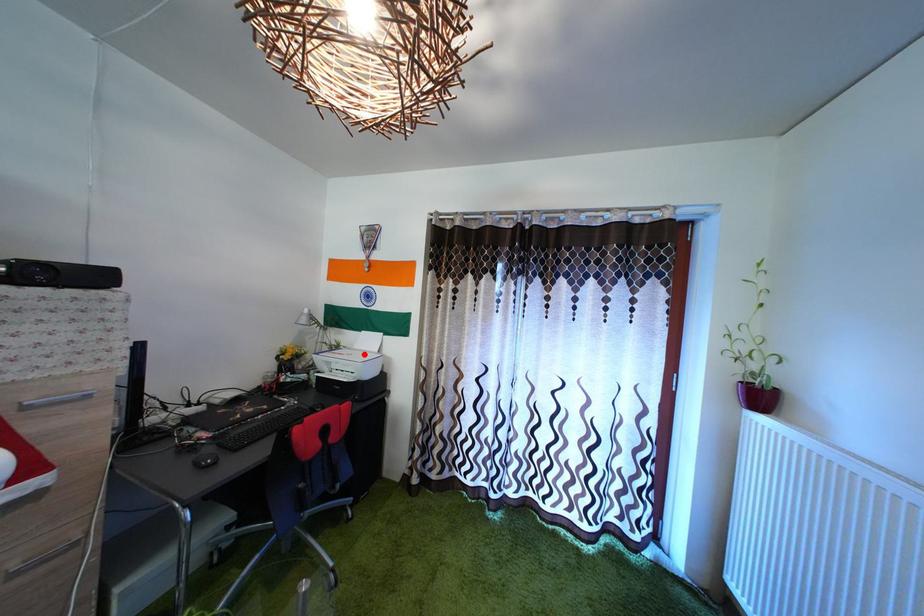
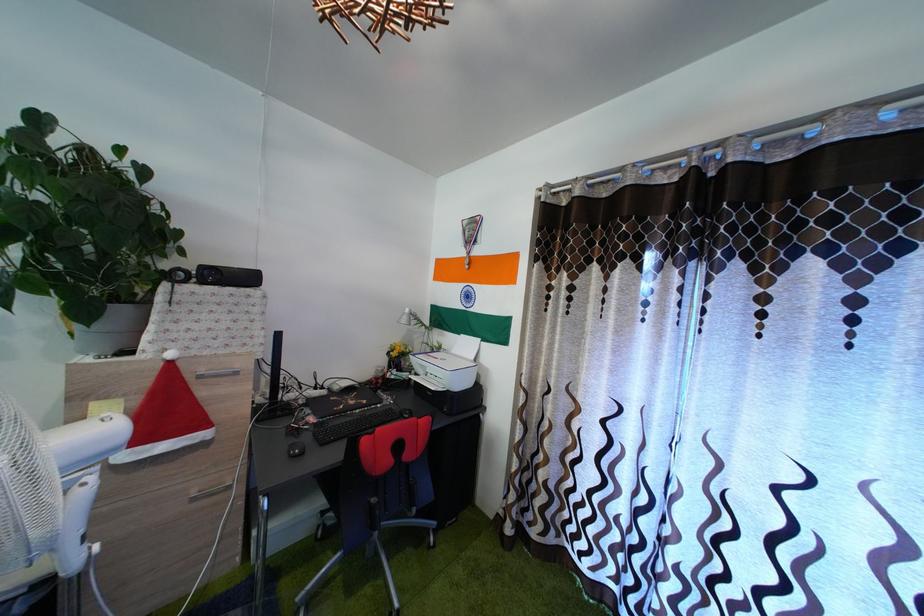
Find the pixel in the second image that matches the highlighted location in the first image.

(462, 359)